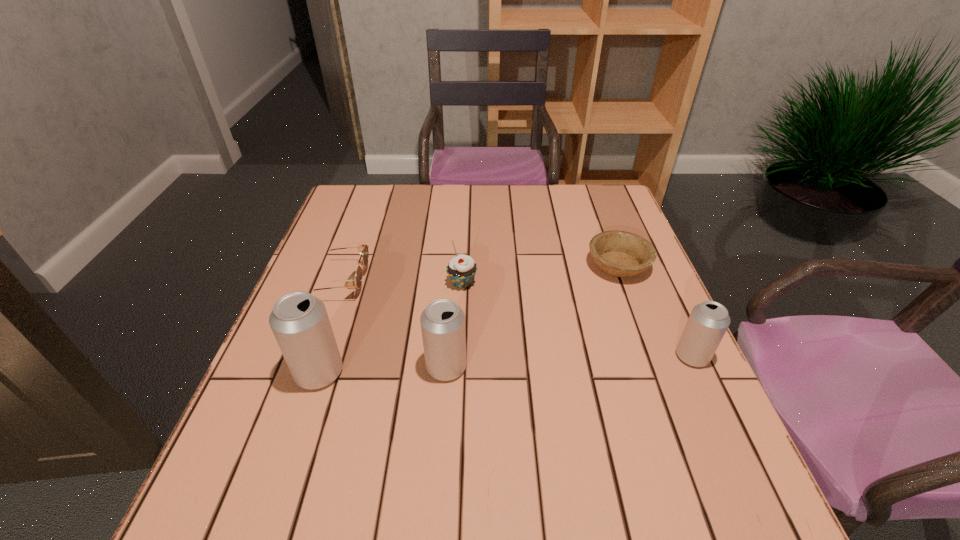
Where is `free space that satisfies the following two spatial constraints: 1. on the back side of the leftmost beer can; 2. on the right side of the cupcake`? This screenshot has width=960, height=540. free space that satisfies the following two spatial constraints: 1. on the back side of the leftmost beer can; 2. on the right side of the cupcake is located at coordinates coord(349,283).